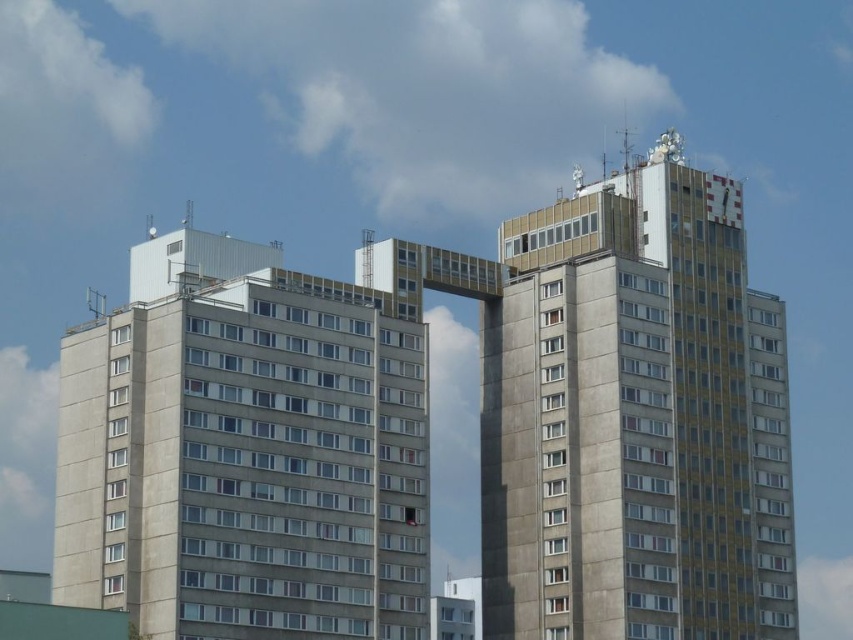
Between point (692, 584) and point (132, 269), which one is positioned behind?

Point (132, 269)

Does yellowish concrete building at upper right appear on the left side of gray concrete building at left?

Incorrect, yellowish concrete building at upper right is not on the left side of gray concrete building at left.

Measure the distance between yellowish concrete building at upper right and camera.

The distance of yellowish concrete building at upper right from camera is 81.91 meters.

The image size is (853, 640). What are the coordinates of `yellowish concrete building at upper right` in the screenshot? It's located at (635, 419).